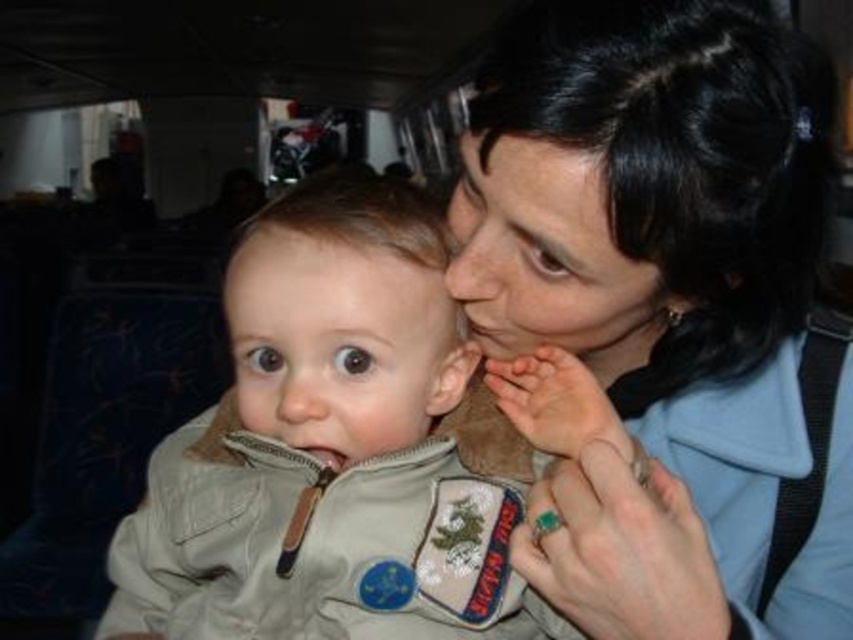
Question: Does smooth skin face at center appear under light brown matte forehead at center?

Choices:
 (A) no
 (B) yes

Answer: (A)

Question: Which object is positioned closest to the light brown matte forehead at center?

Choices:
 (A) smooth beige baby at center
 (B) smooth skin face at center
 (C) matte khaki jacket at center

Answer: (A)

Question: Does matte khaki jacket at center appear over light brown matte forehead at center?

Choices:
 (A) no
 (B) yes

Answer: (A)

Question: Does matte khaki jacket at center appear over light brown matte forehead at center?

Choices:
 (A) yes
 (B) no

Answer: (B)

Question: Among these objects, which one is nearest to the camera?

Choices:
 (A) smooth skin face at center
 (B) matte khaki jacket at center
 (C) light brown matte forehead at center
 (D) smooth beige baby at center

Answer: (B)

Question: Among these points, which one is farthest from the camera?

Choices:
 (A) pos(686,122)
 (B) pos(276,227)
 (C) pos(619,288)

Answer: (B)